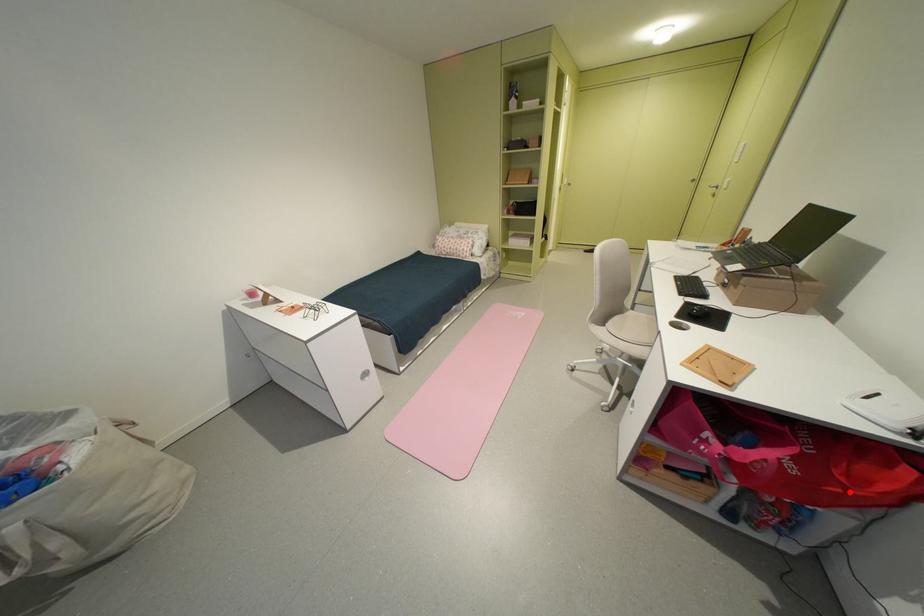
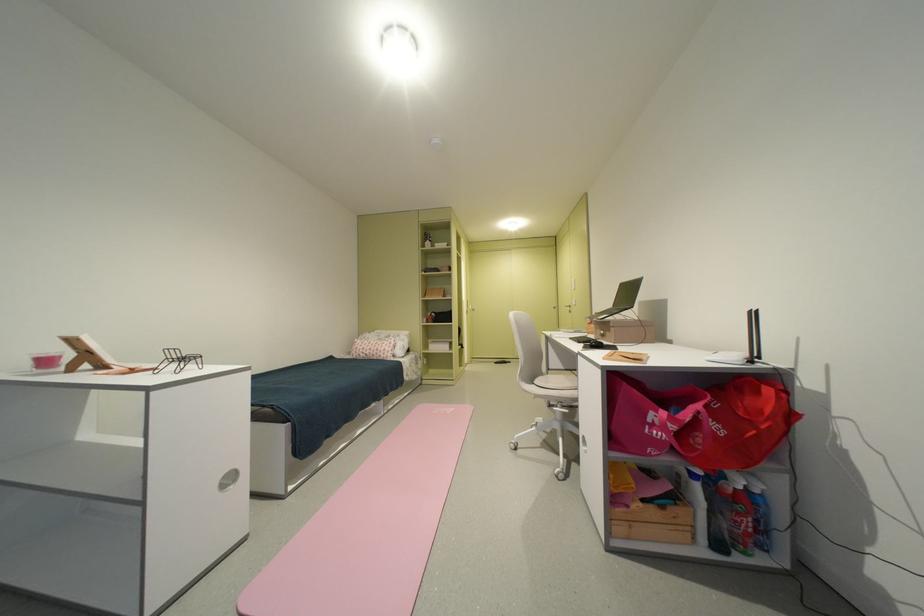
The point at the highlighted location is marked in the first image. Where is the corresponding point in the second image?

(764, 434)